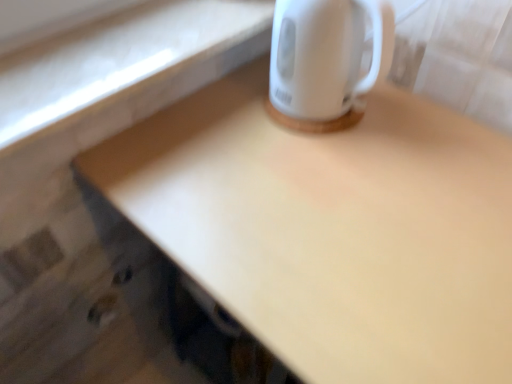
Where is `free space in front of white glossy electric kettle at upper right`? The image size is (512, 384). free space in front of white glossy electric kettle at upper right is located at coordinates (330, 166).